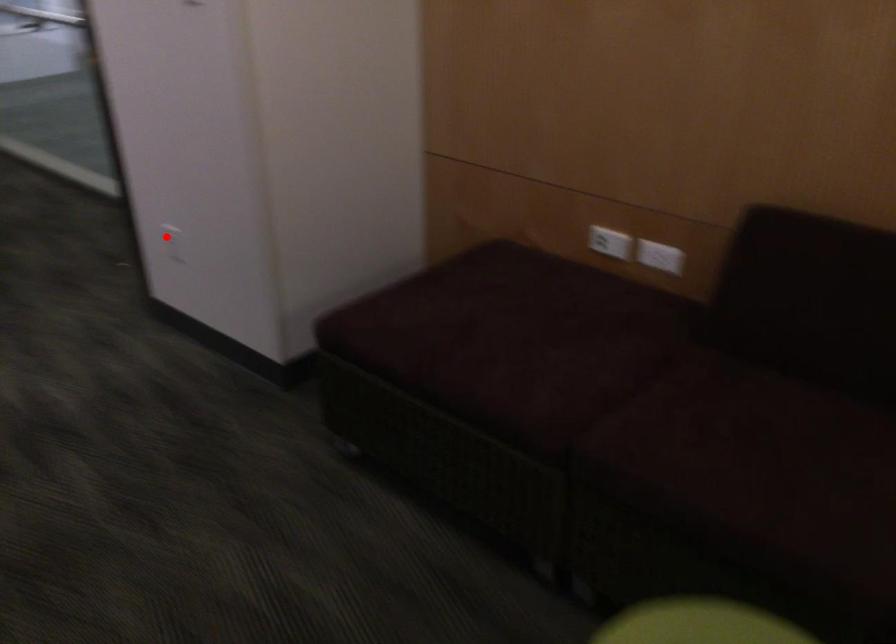
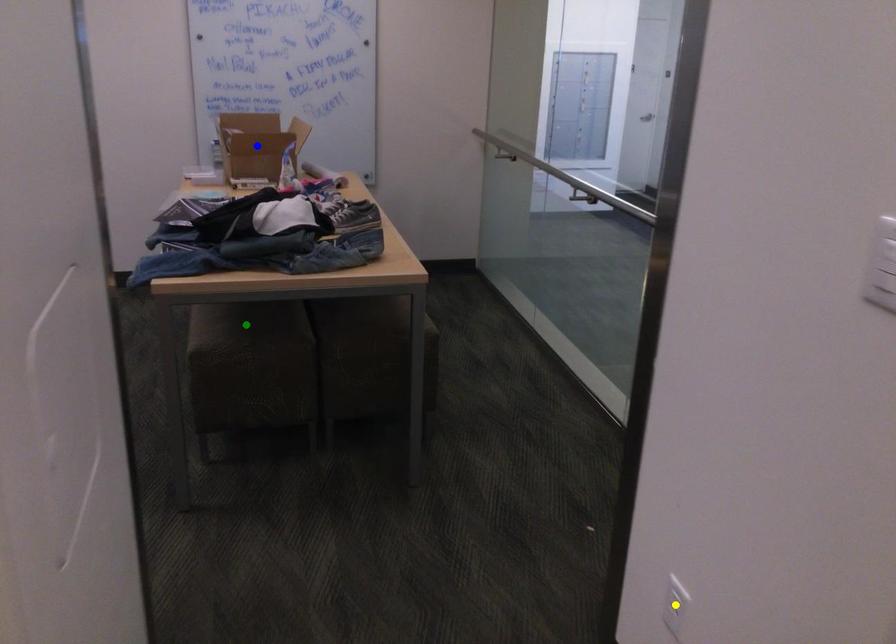
Question: I am providing you with two images of the same scene from different viewpoints. A red point is marked on the first image. You are given multiple points on the second image. Can you choose the point in image 2 that corresponds to the point in image 1?

Choices:
 (A) yellow point
 (B) blue point
 (C) green point

Answer: (A)